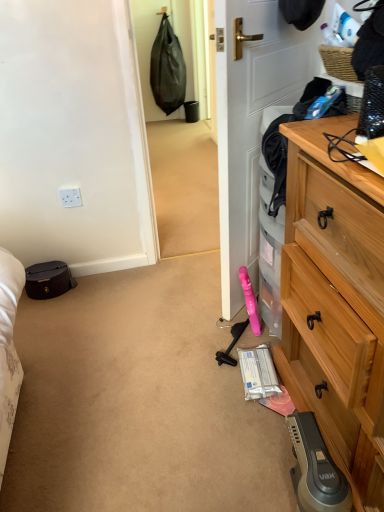
Question: Can you confirm if white plastic power outlet at upper left is positioned to the right of wooden chest of drawers at right?

Choices:
 (A) no
 (B) yes

Answer: (A)

Question: Could you tell me if white plastic power outlet at upper left is facing wooden chest of drawers at right?

Choices:
 (A) no
 (B) yes

Answer: (A)

Question: Is white plastic power outlet at upper left next to wooden chest of drawers at right?

Choices:
 (A) yes
 (B) no

Answer: (B)

Question: Is white plastic power outlet at upper left shorter than wooden chest of drawers at right?

Choices:
 (A) no
 (B) yes

Answer: (B)

Question: Would you say white plastic power outlet at upper left contains wooden chest of drawers at right?

Choices:
 (A) yes
 (B) no

Answer: (B)

Question: Is white plastic power outlet at upper left behind wooden chest of drawers at right?

Choices:
 (A) no
 (B) yes

Answer: (B)

Question: Is white plastic power outlet at upper left positioned far away from matte black suitcase at left?

Choices:
 (A) yes
 (B) no

Answer: (B)

Question: Is matte black suitcase at left completely or partially inside white plastic power outlet at upper left?

Choices:
 (A) yes
 (B) no

Answer: (B)

Question: Can you confirm if white plastic power outlet at upper left is shorter than matte black suitcase at left?

Choices:
 (A) no
 (B) yes

Answer: (B)

Question: Does white plastic power outlet at upper left have a smaller size compared to matte black suitcase at left?

Choices:
 (A) yes
 (B) no

Answer: (A)

Question: Is white plastic power outlet at upper left at the right side of matte black suitcase at left?

Choices:
 (A) no
 (B) yes

Answer: (B)

Question: Is white plastic power outlet at upper left next to matte black suitcase at left and touching it?

Choices:
 (A) no
 (B) yes

Answer: (A)

Question: Is white matte door at center bigger than woven brown picnic basket at upper right?

Choices:
 (A) yes
 (B) no

Answer: (A)